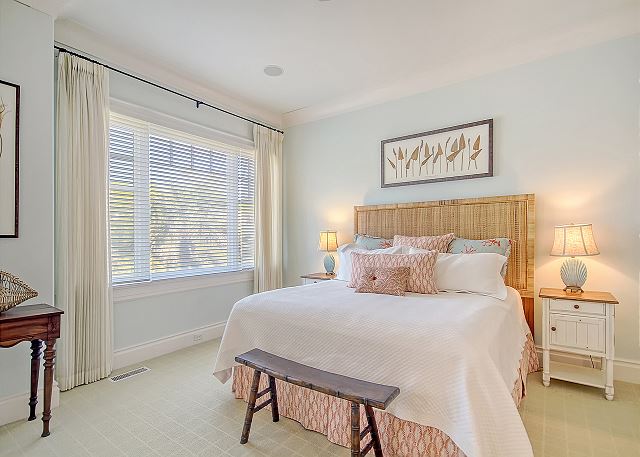
I want to click on pink fabric, so click(397, 430), click(412, 277), click(435, 237), click(385, 275), click(529, 367), click(296, 404).